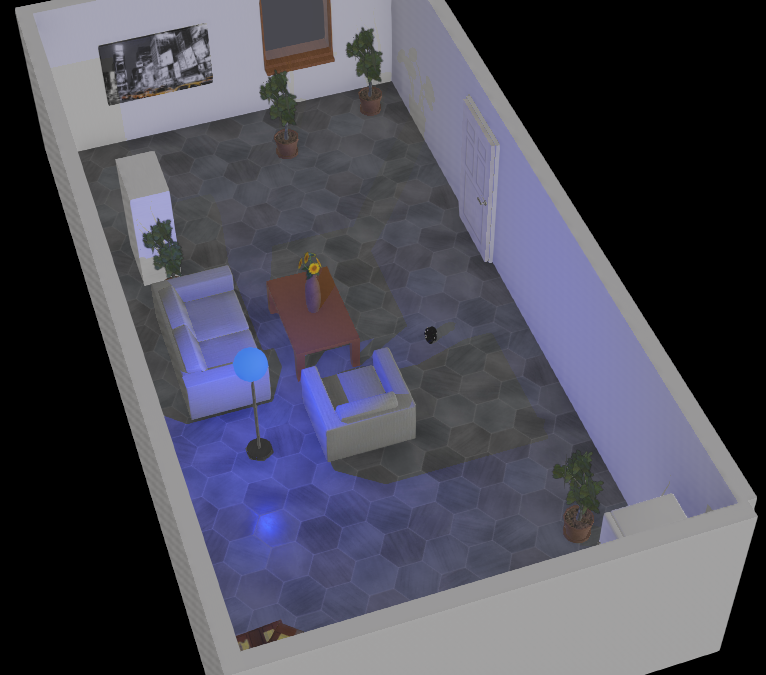
Where is `sofa`? This screenshot has width=766, height=675. sofa is located at coordinates (214, 333).